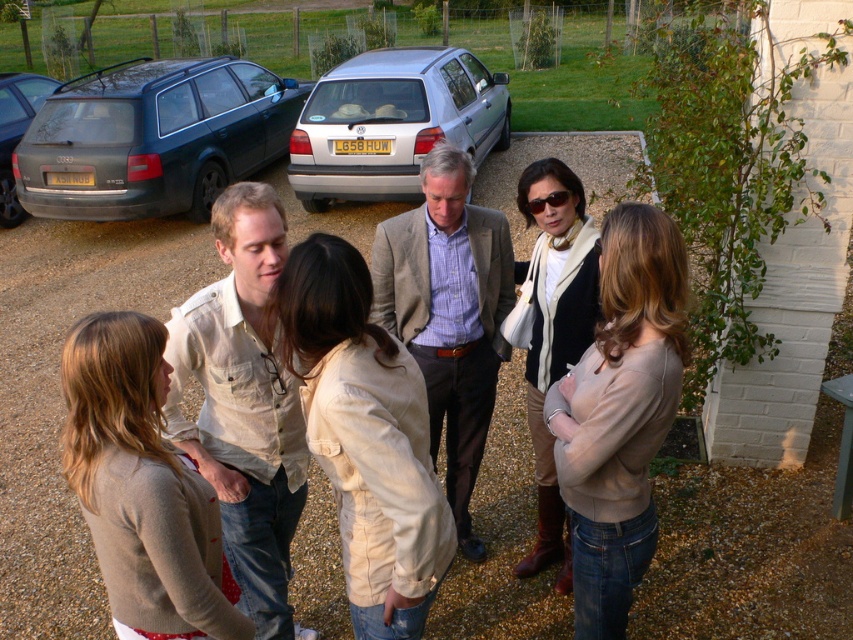
Question: Which point is closer to the camera?

Choices:
 (A) (421, 273)
 (B) (175, 61)

Answer: (A)

Question: Does beige cotton jacket at center appear on the left side of silver metallic hatchback at center?

Choices:
 (A) yes
 (B) no

Answer: (A)

Question: Is light beige shirt at center positioned at the back of velvet black jacket at center?

Choices:
 (A) yes
 (B) no

Answer: (B)

Question: From the image, what is the correct spatial relationship of beige cotton jacket at center in relation to matte beige sweater at center?

Choices:
 (A) left
 (B) right

Answer: (A)

Question: Among these objects, which one is farthest from the camera?

Choices:
 (A) light beige sweater at lower left
 (B) beige cotton shirt at center

Answer: (B)

Question: Which point is farther to the camera?

Choices:
 (A) (561, 632)
 (B) (614, 492)

Answer: (A)